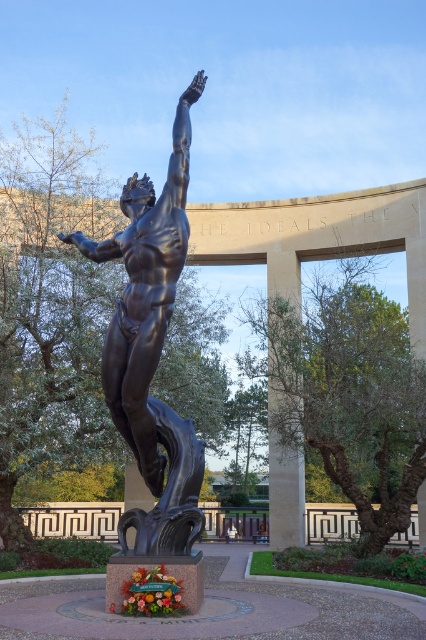
Can you confirm if bronze statue at center is thinner than smooth beige stone pillar at center?

No, bronze statue at center is not thinner than smooth beige stone pillar at center.

In the scene shown: Between bronze statue at center and smooth beige stone pillar at center, which one appears on the left side from the viewer's perspective?

bronze statue at center

I want to click on bronze statue at center, so click(152, 346).

Image resolution: width=426 pixels, height=640 pixels. In order to click on bronze statue at center in this screenshot , I will do `click(152, 346)`.